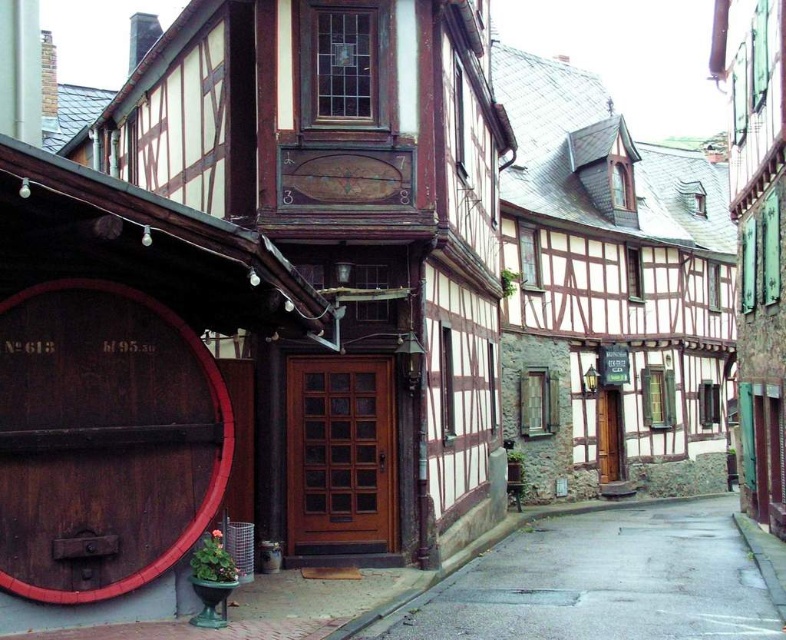
You are a delivery person trying to navigate through the street. You see the dark brown wooden barrel at lower left and the gray concrete alley at center. Which path should you choose to ensure your delivery van, which is 2 meters wide, can pass through comfortably?

The gray concrete alley at center is larger than the dark brown wooden barrel at lower left. Since the alley is wider, the delivery van can pass through the gray concrete alley at center comfortably.

You are standing at the point marked by the coordinates (103,440) on the image, which is the location of the dark brown wooden barrel at lower left. You want to walk directly towards the plaque on the closest building that has the numbers 3 and 8. Will you have to navigate around any obstacles between your current position and the plaque?

The plaque on the closest building with numbers 3 and 8 is located below the second story window. Since the dark brown wooden barrel at lower left is at your current position, you would need to walk towards the building. However, there are no obstacles mentioned between the barrel and the plaque in the scene description, so you can proceed directly.